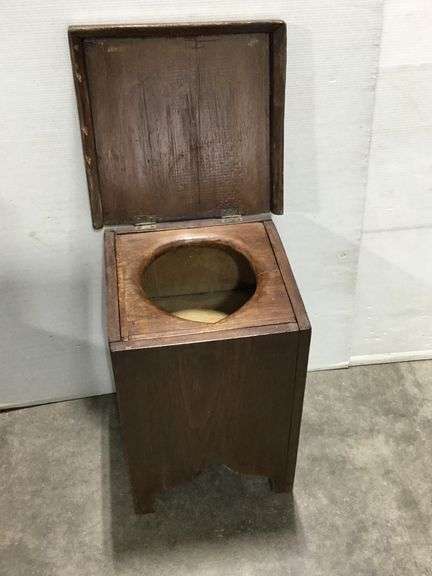
You are a GUI agent. You are given a task and a screenshot of the screen. Output one action in this format:
    pyautogui.click(x=<x>, y=<y>)
    Task: Click on the wall
    
    Given the screenshot: What is the action you would take?
    pyautogui.click(x=56, y=219)